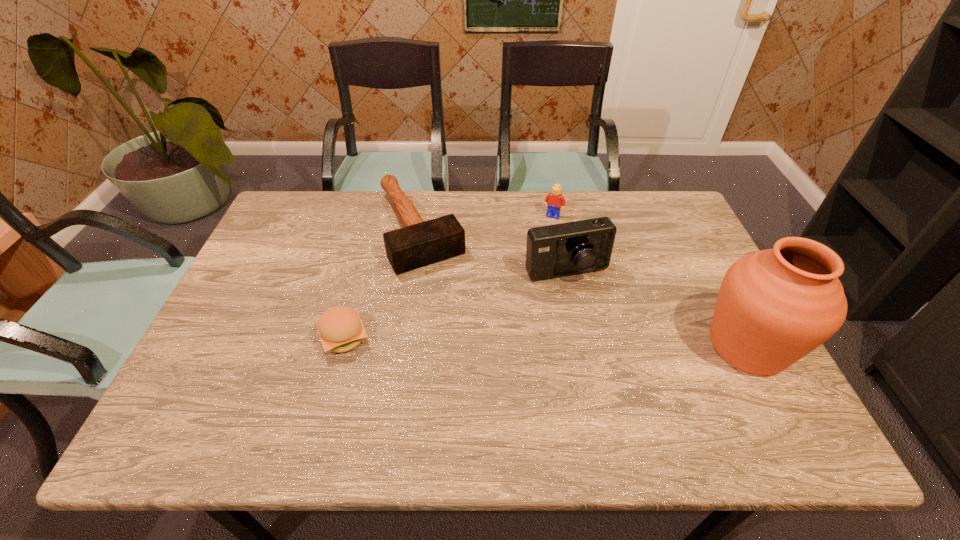
Find the location of a particular element. The image size is (960, 540). vacant area situated 0.100m on the striking face of the mallet is located at coordinates (449, 294).

Where is `vacant space located 0.250m on the front-facing side of the camera`? The width and height of the screenshot is (960, 540). vacant space located 0.250m on the front-facing side of the camera is located at coordinates (612, 363).

The width and height of the screenshot is (960, 540). What are the coordinates of `vacant space positioned 0.320m on the front-facing side of the camera` in the screenshot? It's located at (625, 389).

At what (x,y) coordinates should I click in order to perform the action: click on vacant space situated 0.330m on the front-facing side of the camera. Please return your answer as a coordinate pair (x, y). The image size is (960, 540). Looking at the image, I should click on (627, 393).

Locate an element on the screen. This screenshot has width=960, height=540. vacant space located 0.150m on the front-facing side of the Lego is located at coordinates (535, 249).

Image resolution: width=960 pixels, height=540 pixels. What are the coordinates of `vacant space located on the front-facing side of the Lego` in the screenshot? It's located at (540, 237).

Where is `blank space located 0.080m on the front-facing side of the Lego`? The width and height of the screenshot is (960, 540). blank space located 0.080m on the front-facing side of the Lego is located at coordinates (541, 235).

The width and height of the screenshot is (960, 540). I want to click on mallet present at the far edge, so click(419, 243).

Image resolution: width=960 pixels, height=540 pixels. I want to click on Lego at the far edge, so click(x=554, y=201).

Identify the location of object located in the near edge section of the desktop. (775, 306).